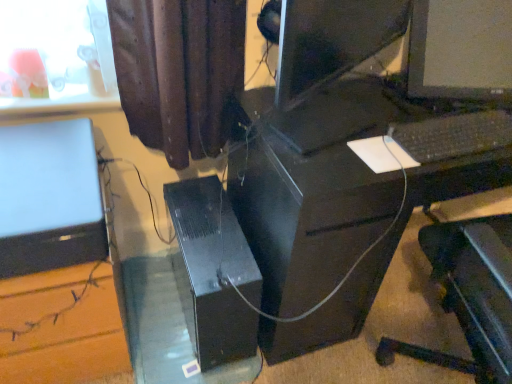
In order to click on free space to the back side of black plastic keyboard at center in this screenshot , I will do `click(433, 103)`.